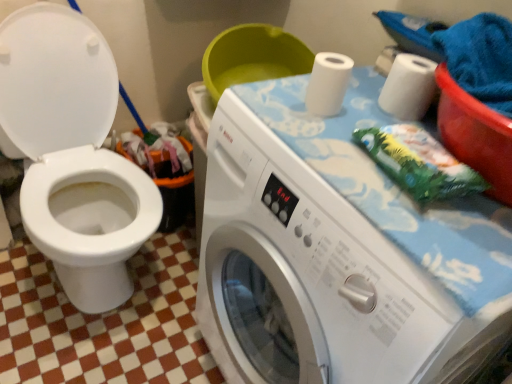
Where is `space that is in front of green fabric at upper right`? This screenshot has height=384, width=512. space that is in front of green fabric at upper right is located at coordinates (432, 240).